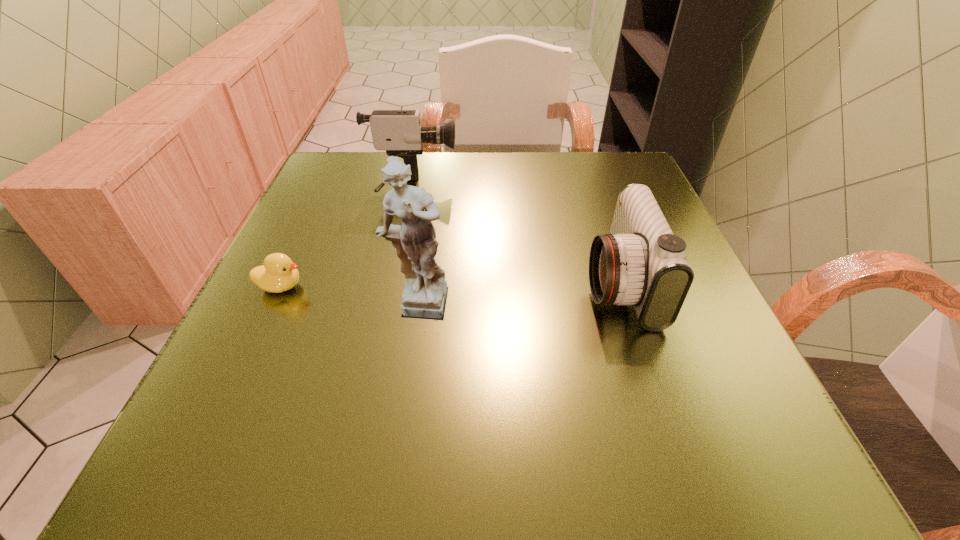
Image resolution: width=960 pixels, height=540 pixels. In order to click on the tallest object in this screenshot , I will do `click(425, 292)`.

This screenshot has width=960, height=540. Find the location of `the left camcorder`. the left camcorder is located at coordinates (399, 132).

I want to click on the farther camcorder, so click(x=399, y=132).

This screenshot has width=960, height=540. In order to click on the right camcorder in this screenshot , I will do `click(641, 262)`.

This screenshot has height=540, width=960. What are the coordinates of `the rightmost object` in the screenshot? It's located at (641, 262).

This screenshot has height=540, width=960. In order to click on the shortest object in this screenshot , I will do `click(278, 274)`.

Identify the location of the leftmost object. Image resolution: width=960 pixels, height=540 pixels. (278, 274).

You are a GUI agent. You are given a task and a screenshot of the screen. Output one action in this format:
    pyautogui.click(x=<x>, y=<y>)
    Task: Click on the vacant space situated 0.120m on the front-facing side of the figurine
    The width and height of the screenshot is (960, 540).
    Given the screenshot: What is the action you would take?
    pyautogui.click(x=404, y=401)

Find the location of a particular element. vacant space situated on the recording direction of the farthest object is located at coordinates (562, 189).

I want to click on free space located on the surface of the right camcorder, so click(x=432, y=283).